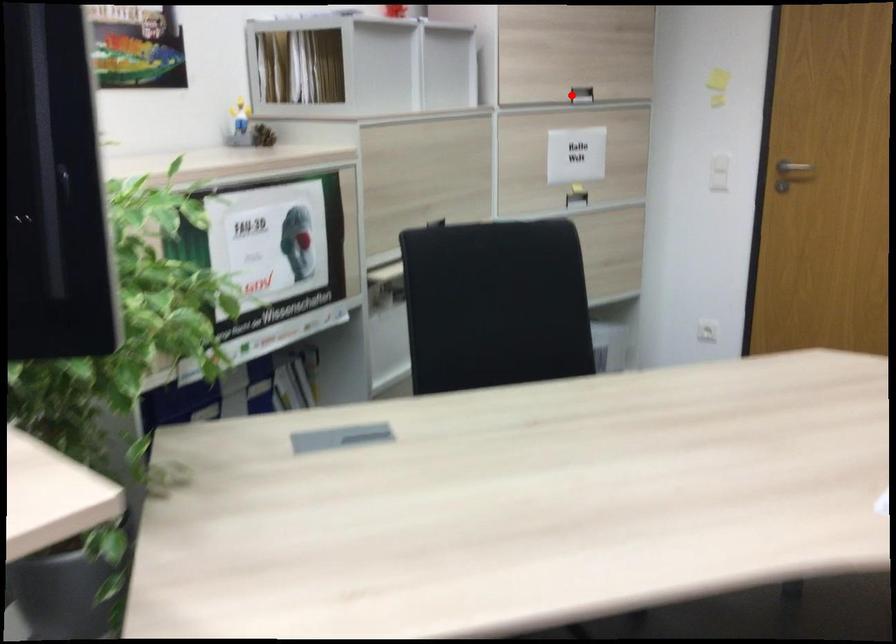
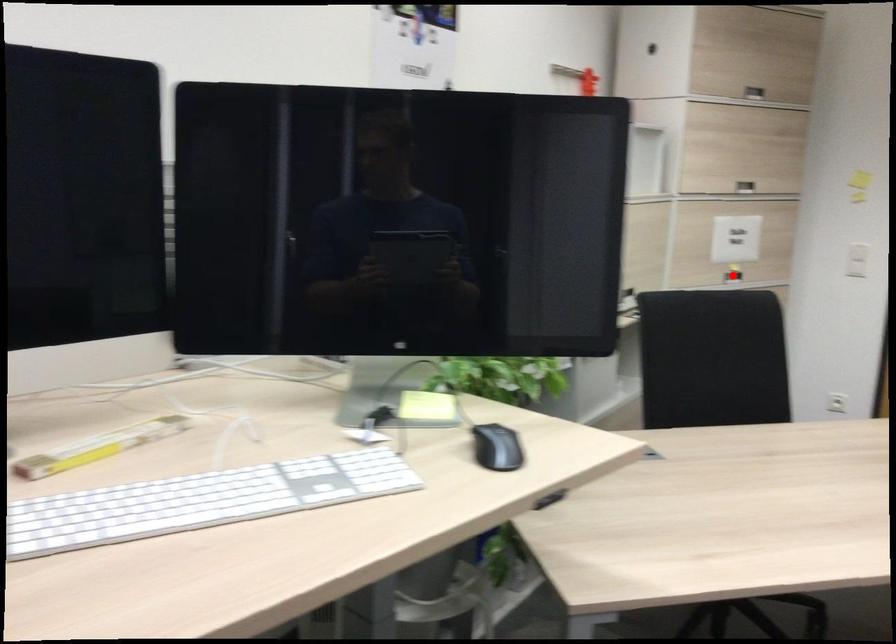
I am providing you with two images of the same scene from different viewpoints. A red point is marked on the first image and another point is marked on the second image. Does the point marked in image1 correspond to the same location as the one in image2?

No